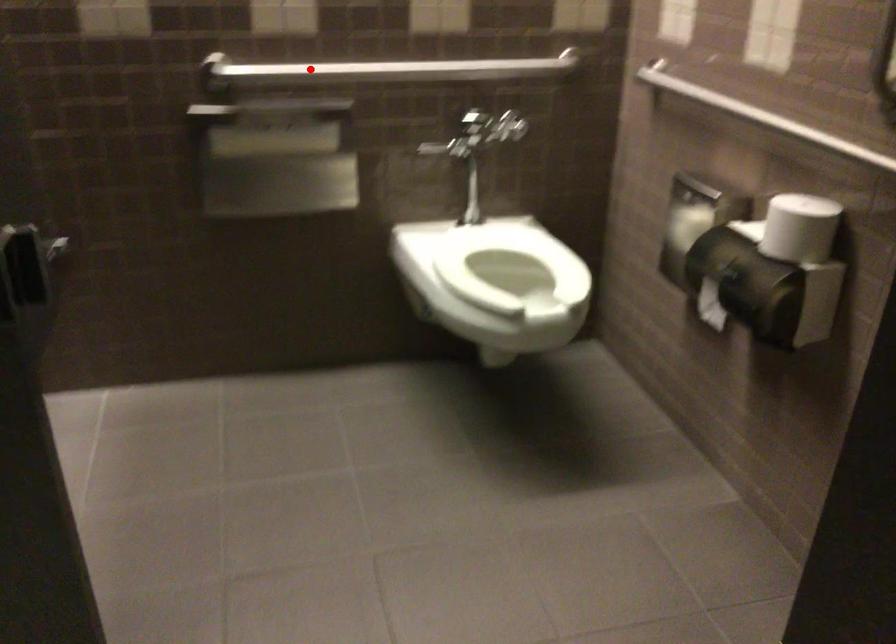
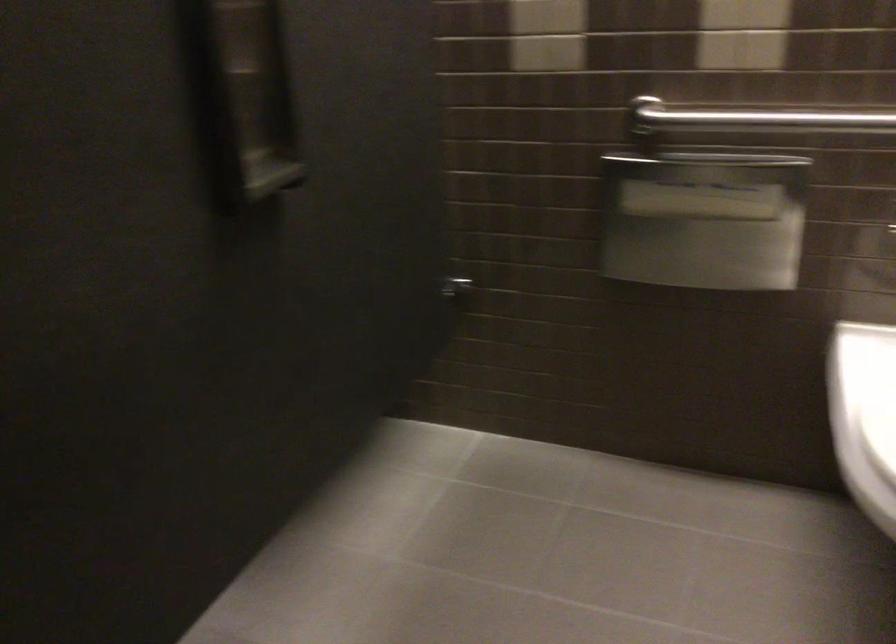
Locate, in the second image, the point that corresponds to the highlighted location in the first image.

(751, 116)